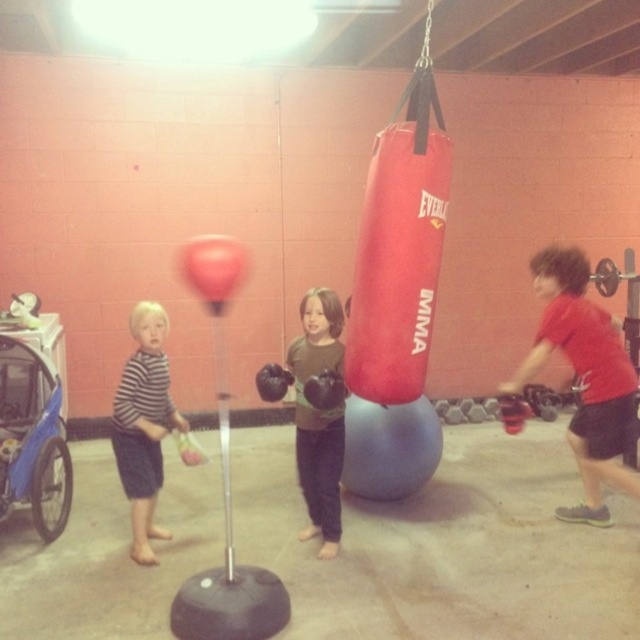
You are a parent standing at the camera position in the scene. There is a red matte boxing glove at right. Can you reach it without moving from your current position?

The red matte boxing glove at right is 3.36 meters from camera, so yes, you can reach it without moving from your current position if you can extend your arm that far.

You are a photographer standing at the center of the room. You want to take a photo that includes both the point at coordinates point (333, 419) and point (150, 342). Which point should you focus on to ensure both are in sharp focus?

You should focus on point (333, 419) because it is closer to the camera than point (150, 342). This way, both points will be within the depth of field and appear sharp in the photo.